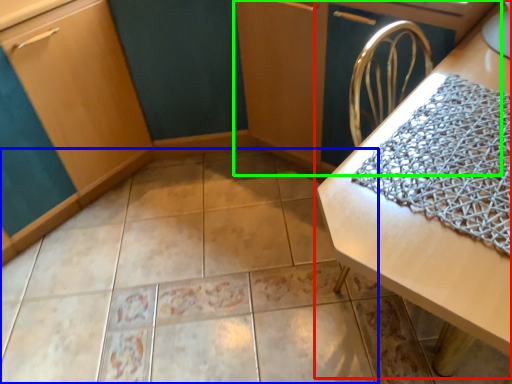
Question: Based on their relative distances, which object is farther from table (highlighted by a red box)? Choose from ceramic tile (highlighted by a blue box) and dresser (highlighted by a green box).

Choices:
 (A) ceramic tile
 (B) dresser

Answer: (A)